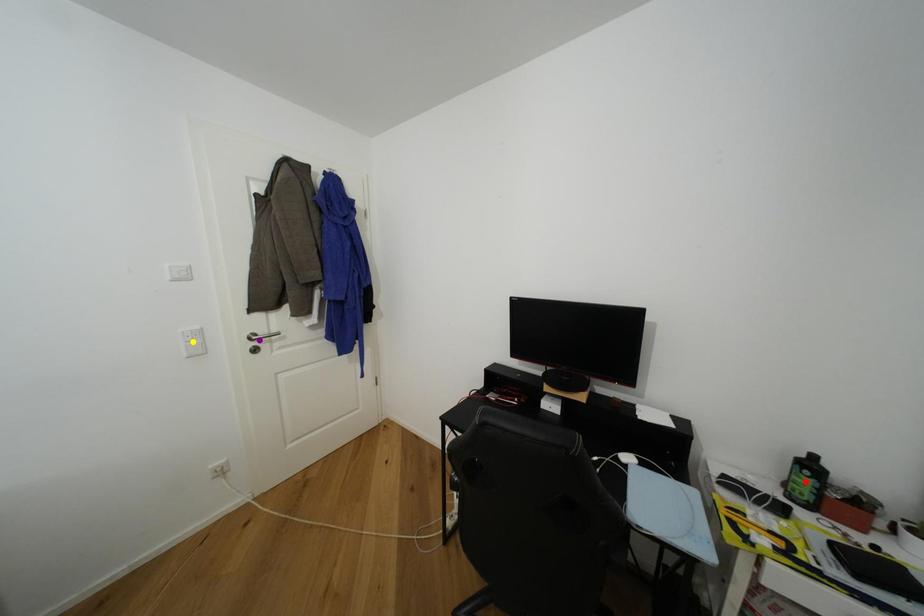
Order these from nearest to farthest:
A) purple point
B) yellow point
C) red point

red point → yellow point → purple point